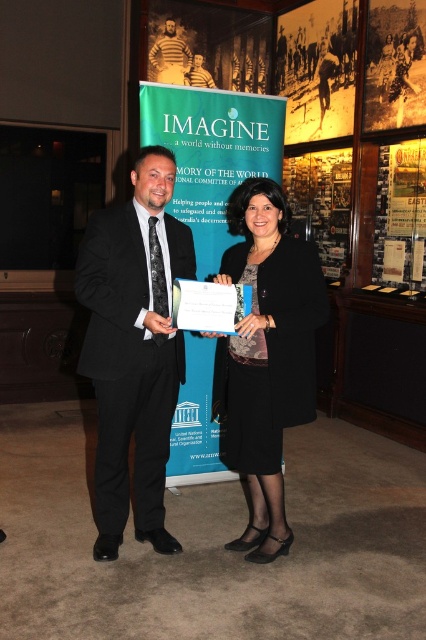
Question: Is yellow paper at upper center further to camera compared to yellow striped sweater at upper center?

Choices:
 (A) yes
 (B) no

Answer: (B)

Question: Can you confirm if blue paper at center is positioned below yellow paper at upper center?

Choices:
 (A) yes
 (B) no

Answer: (A)

Question: Which object is positioned closest to the black fabric coat at center?

Choices:
 (A) yellow striped sweater at upper center
 (B) blue paper at center
 (C) black suit at center

Answer: (C)

Question: Which object is closer to the camera taking this photo?

Choices:
 (A) black fabric coat at center
 (B) blue paper at center
 (C) metallic gold plaque at upper right
 (D) yellow striped sweater at upper center

Answer: (A)

Question: Estimate the real-world distances between objects in this image. Which object is closer to the metallic gold plaque at upper right?

Choices:
 (A) black fabric coat at center
 (B) blue paper at center
 (C) yellow striped sweater at upper center

Answer: (B)

Question: Can you confirm if blue paper at center is smaller than yellow striped sweater at upper center?

Choices:
 (A) yes
 (B) no

Answer: (B)